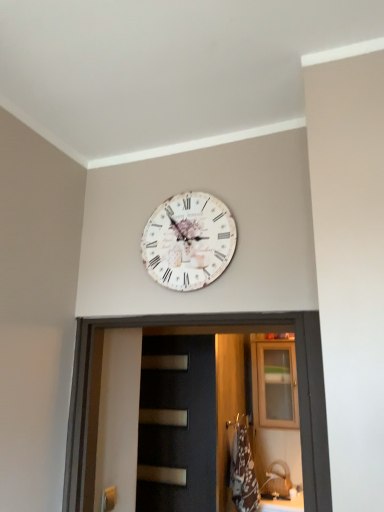
Question: Choose the correct answer: Is white vintage clock at upper center inside wooden cabinet at upper center or outside it?

Choices:
 (A) inside
 (B) outside

Answer: (B)

Question: Does point (208, 284) appear closer or farther from the camera than point (258, 377)?

Choices:
 (A) farther
 (B) closer

Answer: (B)

Question: Considering the real-world distances, which object is closest to the black matte door at center?

Choices:
 (A) white vintage clock at upper center
 (B) brushed metal door handle at lower left
 (C) wooden cabinet at upper center

Answer: (B)

Question: Estimate the real-world distances between objects in this image. Which object is farther from the white vintage clock at upper center?

Choices:
 (A) black matte door at center
 (B) wooden cabinet at upper center
 (C) brushed metal door handle at lower left

Answer: (B)